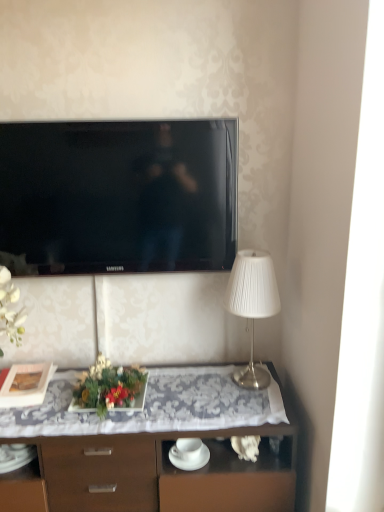
What are the coordinates of `free space to the left of green leafy plant at center` in the screenshot? It's located at point(51,402).